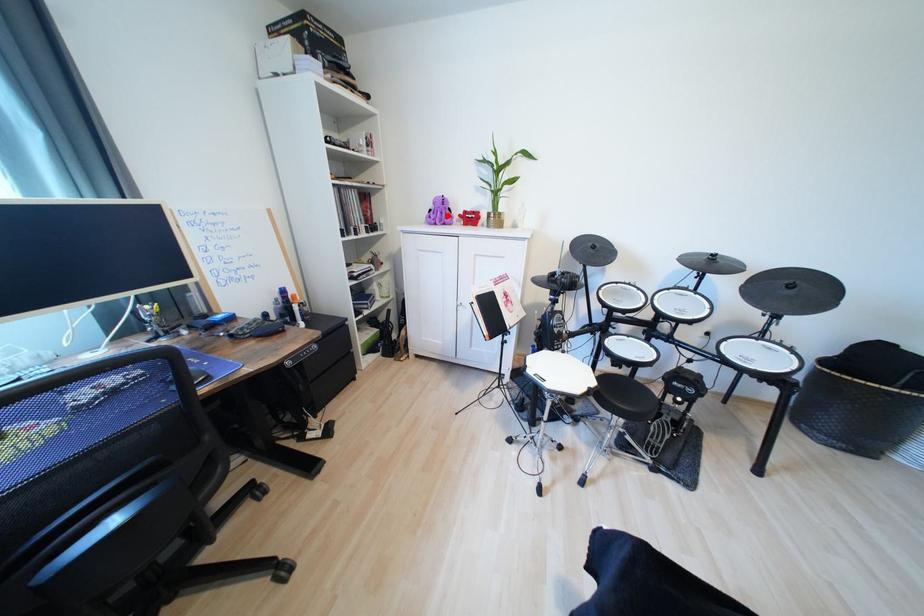
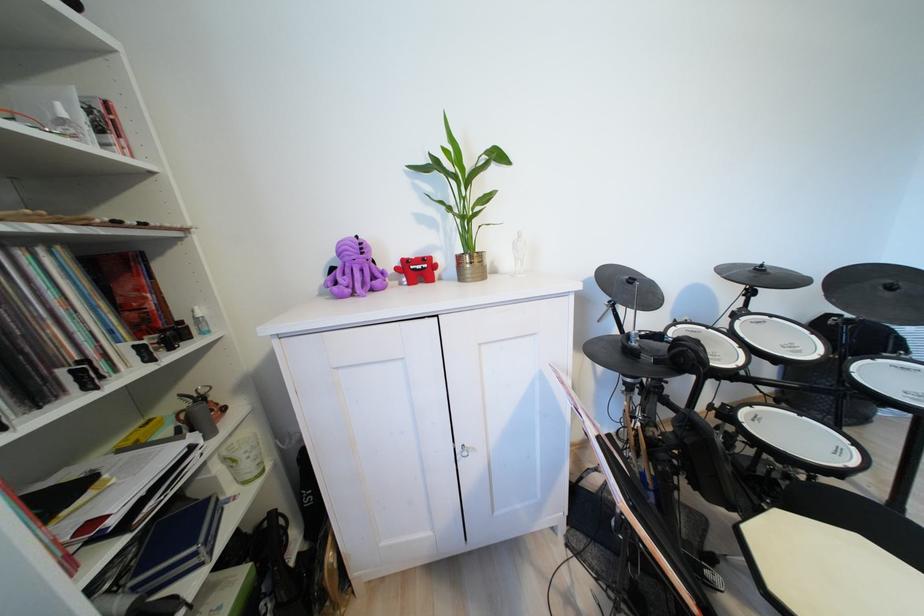
Locate, in the second image, the point that corresponds to the highlighted location in the first image.

(360, 274)